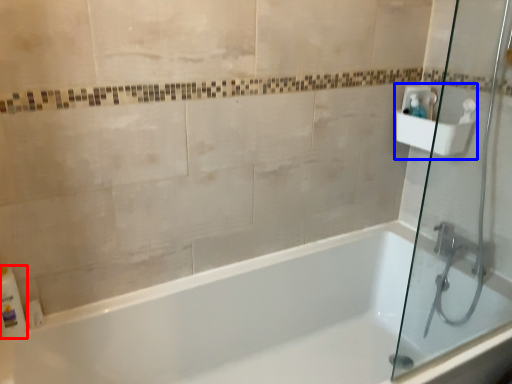
Question: Among these objects, which one is nearest to the camera, toiletry (highlighted by a red box) or sink (highlighted by a blue box)?

Choices:
 (A) toiletry
 (B) sink

Answer: (A)